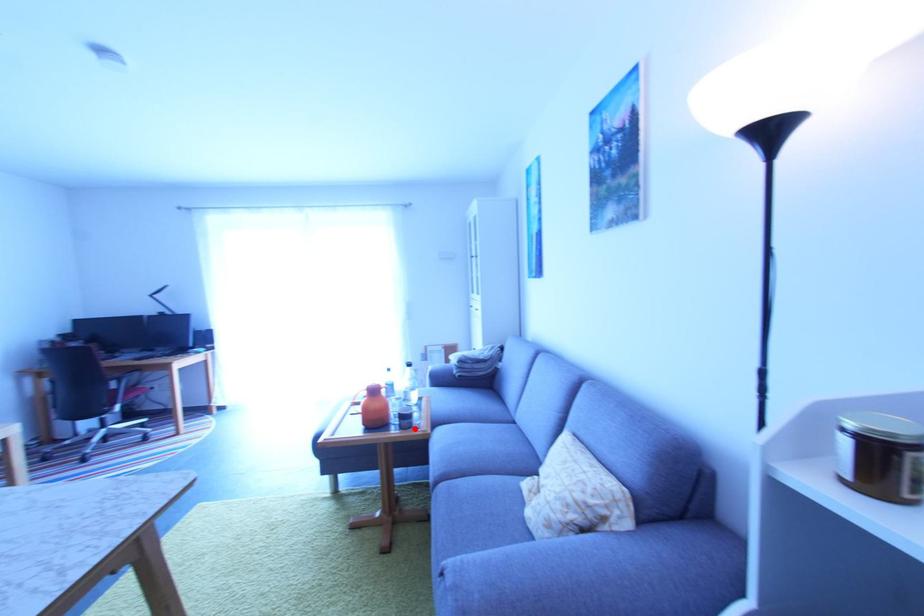
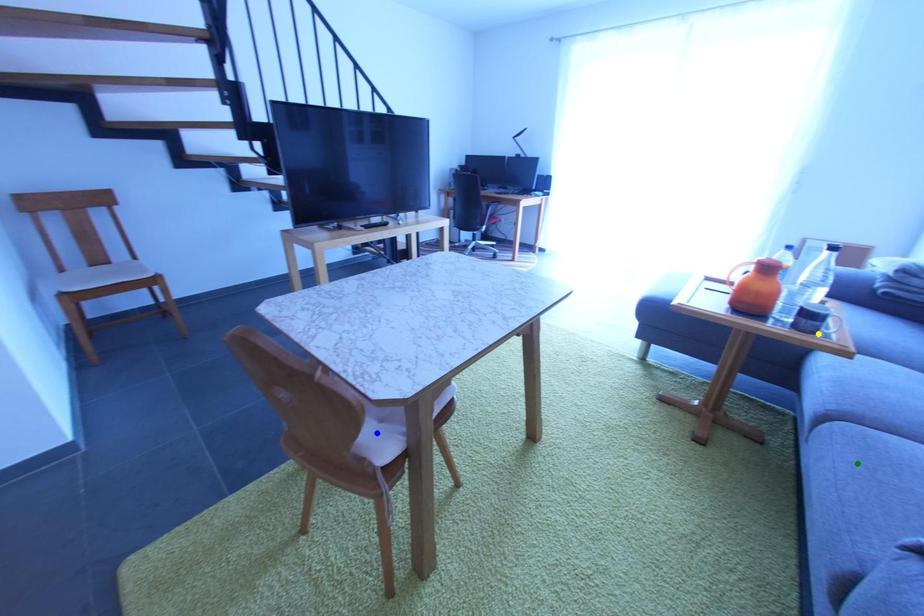
Question: I am providing you with two images of the same scene from different viewpoints. A red point is marked on the first image. You are given multiple points on the second image. Which mark in image 2 goes with the point in image 1?

Choices:
 (A) green point
 (B) yellow point
 (C) blue point

Answer: (B)